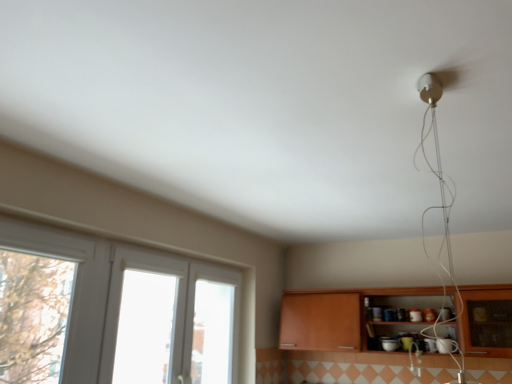
Where is `wooden cabinet at lower right`? The height and width of the screenshot is (384, 512). wooden cabinet at lower right is located at coordinates (338, 318).

What do you see at coordinates (338, 318) in the screenshot? I see `wooden cabinet at lower right` at bounding box center [338, 318].

The width and height of the screenshot is (512, 384). Identify the location of white plastic window at left. (111, 312).

Image resolution: width=512 pixels, height=384 pixels. What do you see at coordinates (111, 312) in the screenshot?
I see `white plastic window at left` at bounding box center [111, 312].

Where is `wooden cabinet at lower right`? wooden cabinet at lower right is located at coordinates (338, 318).

In the scene shown: Which object is positioned more to the right, white plastic window at left or wooden cabinet at lower right?

From the viewer's perspective, wooden cabinet at lower right appears more on the right side.

Is white plastic window at left positioned before wooden cabinet at lower right?

Yes, it is in front of wooden cabinet at lower right.

Does point (176, 288) lie in front of point (388, 294)?

That is True.

From the image's perspective, relative to wooden cabinet at lower right, is white plastic window at left above or below?

From the image's perspective, white plastic window at left appears above wooden cabinet at lower right.

From a real-world perspective, is white plastic window at left below wooden cabinet at lower right?

Yes, from a real-world perspective, white plastic window at left is beneath wooden cabinet at lower right.

Considering the sizes of objects white plastic window at left and wooden cabinet at lower right in the image provided, who is wider, white plastic window at left or wooden cabinet at lower right?

Wider between the two is wooden cabinet at lower right.

Is white plastic window at left shorter than wooden cabinet at lower right?

No, white plastic window at left is not shorter than wooden cabinet at lower right.

Which of these two, white plastic window at left or wooden cabinet at lower right, is bigger?

Bigger between the two is wooden cabinet at lower right.

Do you think white plastic window at left is within wooden cabinet at lower right, or outside of it?

white plastic window at left exists outside the volume of wooden cabinet at lower right.

Is the surface of white plastic window at left in direct contact with wooden cabinet at lower right?

No.

Is white plastic window at left oriented towards wooden cabinet at lower right?

Yes, white plastic window at left faces towards wooden cabinet at lower right.

You are a GUI agent. You are given a task and a screenshot of the screen. Output one action in this format:
    pyautogui.click(x=<x>, y=<y>)
    Task: Click on the cabinetry below the white plastic window at left (from the image's perspective)
    The width and height of the screenshot is (512, 384).
    Given the screenshot: What is the action you would take?
    pyautogui.click(x=338, y=318)

In the image, is wooden cabinet at lower right on the left side or the right side of white plastic window at left?

wooden cabinet at lower right is positioned on white plastic window at left's right side.

Does wooden cabinet at lower right come behind white plastic window at left?

Yes, it is.

Is point (334, 328) in front of point (48, 279)?

No.

From the image's perspective, is wooden cabinet at lower right located above white plastic window at left?

Incorrect, from the image's perspective, wooden cabinet at lower right is lower than white plastic window at left.

Consider the image. From a real-world perspective, which object stands above the other?

In real-world perspective, wooden cabinet at lower right is above.

Which object is wider, wooden cabinet at lower right or white plastic window at left?

Wider between the two is wooden cabinet at lower right.

In terms of height, does wooden cabinet at lower right look taller or shorter compared to white plastic window at left?

In the image, wooden cabinet at lower right appears to be shorter than white plastic window at left.

Is wooden cabinet at lower right smaller than white plastic window at left?

Actually, wooden cabinet at lower right might be larger than white plastic window at left.

Is white plastic window at left inside wooden cabinet at lower right?

No, wooden cabinet at lower right does not contain white plastic window at left.

Is there a large distance between wooden cabinet at lower right and white plastic window at left?

Yes, wooden cabinet at lower right and white plastic window at left are located far from each other.

Is wooden cabinet at lower right looking in the opposite direction of white plastic window at left?

wooden cabinet at lower right is not turned away from white plastic window at left.

How different are the orientations of wooden cabinet at lower right and white plastic window at left in degrees?

The facing directions of wooden cabinet at lower right and white plastic window at left are 90 degrees apart.

Measure the distance between wooden cabinet at lower right and white plastic window at left.

wooden cabinet at lower right is 1.46 meters away from white plastic window at left.

This screenshot has height=384, width=512. I want to click on window that appears on the left of wooden cabinet at lower right, so click(111, 312).

You are a GUI agent. You are given a task and a screenshot of the screen. Output one action in this format:
    pyautogui.click(x=<x>, y=<y>)
    Task: Click on the window that is under the wooden cabinet at lower right (from a real-world perspective)
    This screenshot has height=384, width=512.
    Given the screenshot: What is the action you would take?
    pyautogui.click(x=111, y=312)

In order to click on window that appears in front of the wooden cabinet at lower right in this screenshot , I will do `click(111, 312)`.